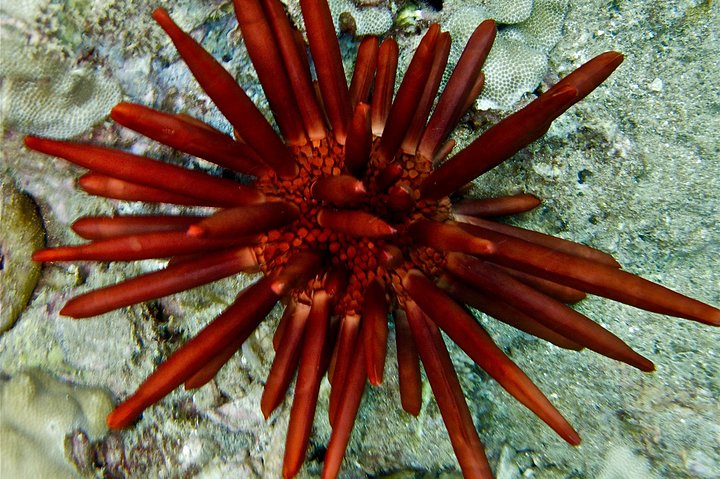
Where is `glass`? This screenshot has width=720, height=479. glass is located at coordinates (631, 334).